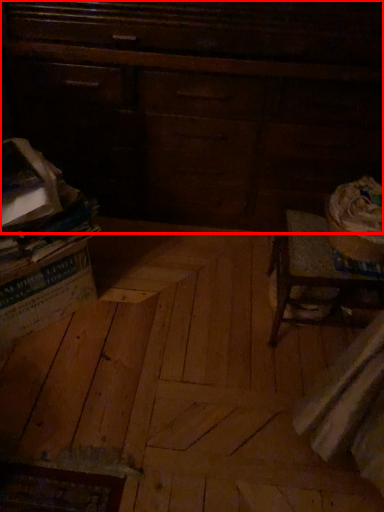
Question: From the image, what is the correct spatial relationship of furniture (annotated by the red box) in relation to plywood?

Choices:
 (A) right
 (B) left

Answer: (A)